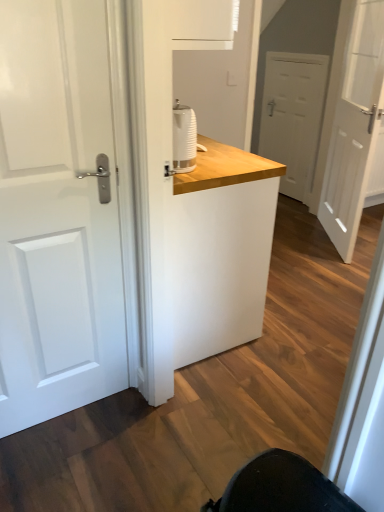
This screenshot has width=384, height=512. What do you see at coordinates (57, 214) in the screenshot?
I see `white glossy door at left, which is the 3th door from back to front` at bounding box center [57, 214].

What are the coordinates of `white matte door at center, the 2th door in the left-to-right sequence` in the screenshot? It's located at (293, 116).

This screenshot has width=384, height=512. What are the coordinates of `white glossy door at left, which is the 1th door in left-to-right order` in the screenshot? It's located at [57, 214].

Looking at this image, does white wood counter at center have a lesser width compared to white matte door at center, the first door from the back?

No.

Considering the relative positions of white wood counter at center and white matte door at center, which is the 2th door from right to left, in the image provided, is white wood counter at center to the left or to the right of white matte door at center, which is the 2th door from right to left,?

From the image, it's evident that white wood counter at center is to the left of white matte door at center, which is the 2th door from right to left.

From the image's perspective, does white wood counter at center appear lower than white matte door at center, the first door from the back?

Yes, from the image's perspective, white wood counter at center is below white matte door at center, the first door from the back.

Which object is closer to the camera taking this photo, white wood counter at center or white matte door at center, the first door from the back?

Positioned in front is white wood counter at center.

Is white matte door at center, the 3th door positioned from the front, positioned with its back to white matte door at right, acting as the 3th door starting from the left?

No, white matte door at right, acting as the 3th door starting from the left, is not at the back of white matte door at center, the 3th door positioned from the front.

Is white matte door at center, which is the 2th door from right to left, directly adjacent to white matte door at right, the second door viewed from the front?

They are not placed beside each other.

Considering the sizes of objects white matte door at center, the 2th door in the left-to-right sequence, and white matte door at right, which ranks as the 2th door in back-to-front order, in the image provided, who is bigger, white matte door at center, the 2th door in the left-to-right sequence, or white matte door at right, which ranks as the 2th door in back-to-front order,?

With larger size is white matte door at right, which ranks as the 2th door in back-to-front order.

Which point is more distant from viewer, (310, 182) or (345, 151)?

The point (310, 182) is farther.

From the image's perspective, who appears lower, white glossy door at left, which is the 1th door from front to back, or white matte door at center, which is the 2th door from right to left?

white glossy door at left, which is the 1th door from front to back, appears lower in the image.

Could you measure the distance between white glossy door at left, which is the 3th door from back to front, and white matte door at center, the first door from the back?

9.13 feet.

Considering their positions, is white glossy door at left, which is the 1th door in left-to-right order, located in front of or behind white matte door at center, the 2th door in the left-to-right sequence?

Visually, white glossy door at left, which is the 1th door in left-to-right order, is located in front of white matte door at center, the 2th door in the left-to-right sequence.

From a real-world perspective, is white glossy door at left, which is the 3th door from back to front, positioned above or below white matte door at center, the first door from the back?

In terms of real-world spatial position, white glossy door at left, which is the 3th door from back to front, is above white matte door at center, the first door from the back.

Is white wood counter at center not inside white glossy door at left, which is the 3th door from back to front?

Indeed, white wood counter at center is completely outside white glossy door at left, which is the 3th door from back to front.

From the image's perspective, is white wood counter at center located beneath white glossy door at left, which is the 1th door in left-to-right order?

No, from the image's perspective, white wood counter at center is not beneath white glossy door at left, which is the 1th door in left-to-right order.

Is white wood counter at center placed right next to white glossy door at left, which is the 1th door from front to back?

No, white wood counter at center is not with white glossy door at left, which is the 1th door from front to back.

From the picture: Looking at their sizes, would you say white matte door at right, the second door viewed from the front, is wider or thinner than white wood counter at center?

Clearly, white matte door at right, the second door viewed from the front, has less width compared to white wood counter at center.

From the image's perspective, is white matte door at right, acting as the 3th door starting from the left, located above or below white wood counter at center?

white matte door at right, acting as the 3th door starting from the left, is above white wood counter at center.

Considering the relative positions of white matte door at right, which ranks as the 2th door in back-to-front order, and white wood counter at center in the image provided, is white matte door at right, which ranks as the 2th door in back-to-front order, to the right of white wood counter at center from the viewer's perspective?

Correct, you'll find white matte door at right, which ranks as the 2th door in back-to-front order, to the right of white wood counter at center.

What's the angular difference between white matte door at right, acting as the 3th door starting from the left, and white wood counter at center's facing directions?

The facing directions of white matte door at right, acting as the 3th door starting from the left, and white wood counter at center are 29.7 degrees apart.

How many degrees apart are the facing directions of white matte door at right, acting as the 3th door starting from the left, and white glossy door at left, which is the 3th door from back to front?

59 degrees.

Considering the relative positions of white matte door at right, the second door viewed from the front, and white glossy door at left, which appears as the 3th door when viewed from the right, in the image provided, is white matte door at right, the second door viewed from the front, to the left or to the right of white glossy door at left, which appears as the 3th door when viewed from the right,?

white matte door at right, the second door viewed from the front, is to the right of white glossy door at left, which appears as the 3th door when viewed from the right.

Is white matte door at right, acting as the 3th door starting from the left, beside white glossy door at left, which appears as the 3th door when viewed from the right?

No, white matte door at right, acting as the 3th door starting from the left, is not touching white glossy door at left, which appears as the 3th door when viewed from the right.

Based on the photo, is white matte door at right, the second door viewed from the front, not inside white glossy door at left, which is the 1th door in left-to-right order?

That's correct, white matte door at right, the second door viewed from the front, is outside of white glossy door at left, which is the 1th door in left-to-right order.

Is white matte door at center, the first door from the back, touching white wood counter at center?

They are not placed beside each other.

How much distance is there between white matte door at center, the 3th door positioned from the front, and white wood counter at center?

white matte door at center, the 3th door positioned from the front, is 2.14 meters away from white wood counter at center.

Is white matte door at center, the 3th door positioned from the front, taller than white wood counter at center?

Yes.

Considering the relative positions of white matte door at center, which is the 2th door from right to left, and white wood counter at center in the image provided, is white matte door at center, which is the 2th door from right to left, behind white wood counter at center?

Yes, the depth of white matte door at center, which is the 2th door from right to left, is greater than that of white wood counter at center.

Find the location of a particular element. counter below the white matte door at center, the first door from the back (from the image's perspective) is located at coordinates (214, 257).

Identify the location of door that is the 2nd one below the white matte door at right, arranged as the first door when viewed from the right (from a real-world perspective). The width and height of the screenshot is (384, 512). (293, 116).

Looking at the image, which one is located closer to white matte door at center, the 2th door in the left-to-right sequence, white wood counter at center or white glossy door at left, which is the 3th door from back to front?

white wood counter at center is closer to white matte door at center, the 2th door in the left-to-right sequence.

Based on their spatial positions, is white matte door at right, which ranks as the 2th door in back-to-front order, or white wood counter at center closer to white glossy door at left, which is the 1th door in left-to-right order?

white wood counter at center lies closer to white glossy door at left, which is the 1th door in left-to-right order, than the other object.

When comparing their distances from white matte door at center, the first door from the back, does white matte door at right, acting as the 3th door starting from the left, or white glossy door at left, which is the 3th door from back to front, seem further?

white glossy door at left, which is the 3th door from back to front, lies further to white matte door at center, the first door from the back, than the other object.

When comparing their distances from white wood counter at center, does white matte door at center, which is the 2th door from right to left, or white matte door at right, the second door viewed from the front, seem further?

white matte door at center, which is the 2th door from right to left, is further to white wood counter at center.

Looking at the image, which one is located closer to white wood counter at center, white matte door at right, arranged as the first door when viewed from the right, or white matte door at center, the first door from the back?

white matte door at right, arranged as the first door when viewed from the right, lies closer to white wood counter at center than the other object.

Looking at the image, which one is located closer to white matte door at right, acting as the 3th door starting from the left, white glossy door at left, which is the 1th door in left-to-right order, or white matte door at center, the first door from the back?

Based on the image, white matte door at center, the first door from the back, appears to be nearer to white matte door at right, acting as the 3th door starting from the left.

When comparing their distances from white wood counter at center, does white matte door at right, the second door viewed from the front, or white glossy door at left, which is the 1th door in left-to-right order, seem further?

white matte door at right, the second door viewed from the front.

Consider the image. Looking at the image, which one is located further to white matte door at right, arranged as the first door when viewed from the right, white matte door at center, the first door from the back, or white wood counter at center?

white wood counter at center is further to white matte door at right, arranged as the first door when viewed from the right.

Image resolution: width=384 pixels, height=512 pixels. In order to click on door between white glossy door at left, which is the 1th door in left-to-right order, and white matte door at center, the 3th door positioned from the front, in the front-back direction in this screenshot , I will do `click(356, 132)`.

Identify the location of door between white wood counter at center and white matte door at center, the 3th door positioned from the front, from front to back. This screenshot has width=384, height=512. (356, 132).

Image resolution: width=384 pixels, height=512 pixels. I want to click on counter between white glossy door at left, which is the 3th door from back to front, and white matte door at center, the first door from the back, along the z-axis, so click(214, 257).

The height and width of the screenshot is (512, 384). I want to click on counter between white glossy door at left, which is the 3th door from back to front, and white matte door at right, the second door viewed from the front, so click(214, 257).